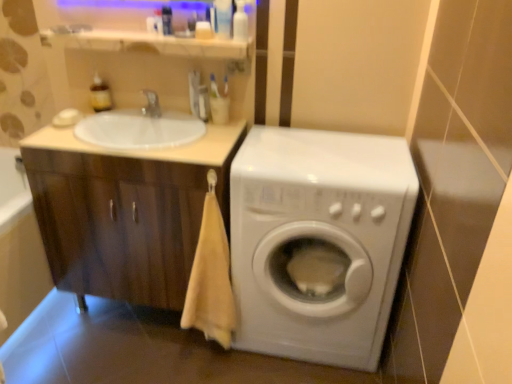
Locate an element on the screen. The image size is (512, 384). vacant space that is in between translucent amber bottle at upper left, which is the first toiletry from left to right, and white glossy tap at upper center is located at coordinates (122, 117).